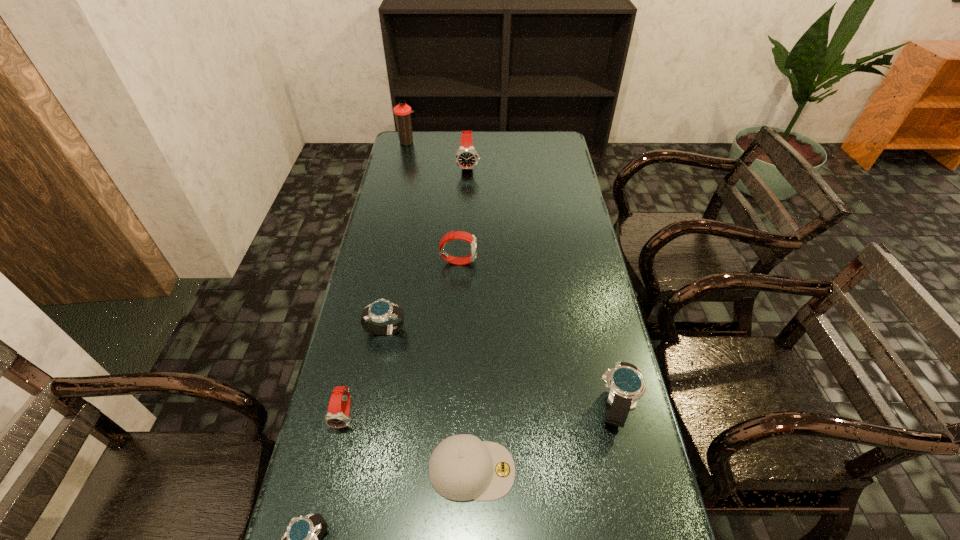
I want to click on vacant region between the rightmost watch and the seventh farthest object, so click(543, 438).

Where is `vacant area that lies between the sixth nearest object and the biggest red watch`? The height and width of the screenshot is (540, 960). vacant area that lies between the sixth nearest object and the biggest red watch is located at coordinates (464, 213).

Locate an element on the screen. free space that is in between the farthest silver watch and the thermos bottle is located at coordinates (396, 236).

Find the location of a particular element. The height and width of the screenshot is (540, 960). vacant space that is in between the second farthest object and the fifth nearest object is located at coordinates (427, 248).

Locate an element on the screen. unoccupied area between the farthest object and the cap is located at coordinates (440, 306).

The width and height of the screenshot is (960, 540). What are the coordinates of `free spot between the rightmost silver watch and the seventh farthest object` in the screenshot? It's located at (543, 438).

Identify which object is located as the nearest to the biggest red watch. Please provide its 2D coordinates. Your answer should be formatted as a tuple, i.e. [(x, y)], where the tuple contains the x and y coordinates of a point satisfying the conditions above.

[(402, 111)]

Find the location of a particular element. This screenshot has height=540, width=960. object that is the second nearest to the farthest red watch is located at coordinates (462, 235).

Image resolution: width=960 pixels, height=540 pixels. I want to click on watch that is the second closest to the second tallest object, so click(381, 310).

The image size is (960, 540). In order to click on watch object that ranks as the fifth closest to the third farthest object in this screenshot , I will do `click(302, 539)`.